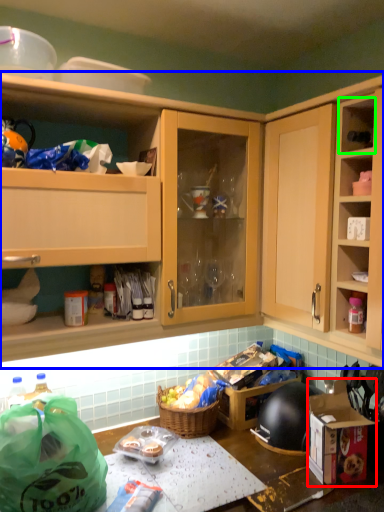
Question: Which is farther away from cardboard box (highlighted by a red box)? cabinetry (highlighted by a blue box) or cabinet (highlighted by a green box)?

Choices:
 (A) cabinetry
 (B) cabinet

Answer: (A)